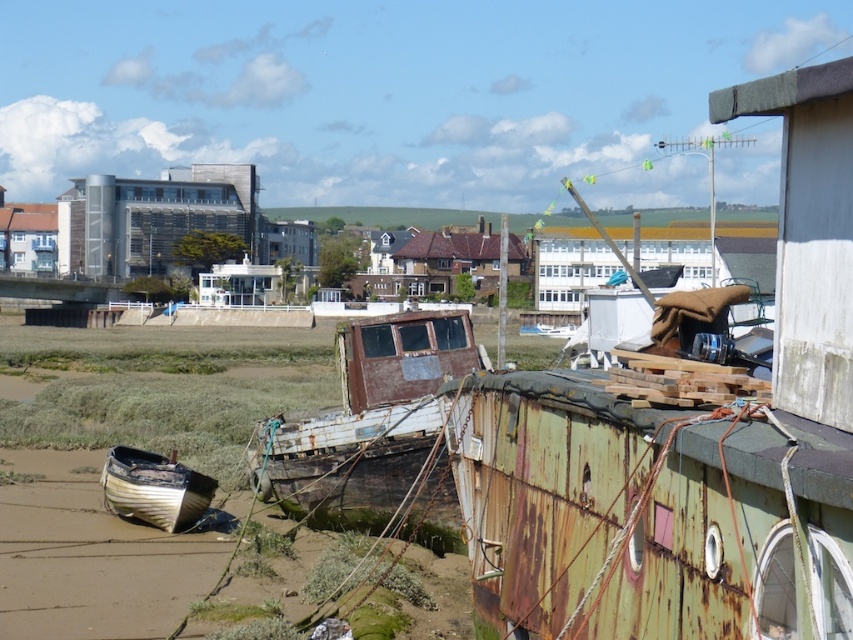
Question: Which point is farther to the camera?

Choices:
 (A) smooth brown sand at lower left
 (B) rusty wood boat at center

Answer: (B)

Question: Based on their relative distances, which object is farther from the rusty wood boat at center?

Choices:
 (A) smooth brown sand at lower left
 (B) wooden boat at lower left

Answer: (B)

Question: From the image, what is the correct spatial relationship of smooth brown sand at lower left in relation to wooden boat at lower left?

Choices:
 (A) below
 (B) above

Answer: (A)

Question: Is rusty wood boat at center bigger than wooden boat at lower left?

Choices:
 (A) no
 (B) yes

Answer: (A)

Question: Does rusty wood boat at center appear under wooden boat at lower left?

Choices:
 (A) yes
 (B) no

Answer: (B)

Question: Which point is farther to the camera?

Choices:
 (A) (222, 534)
 (B) (120, 515)

Answer: (B)